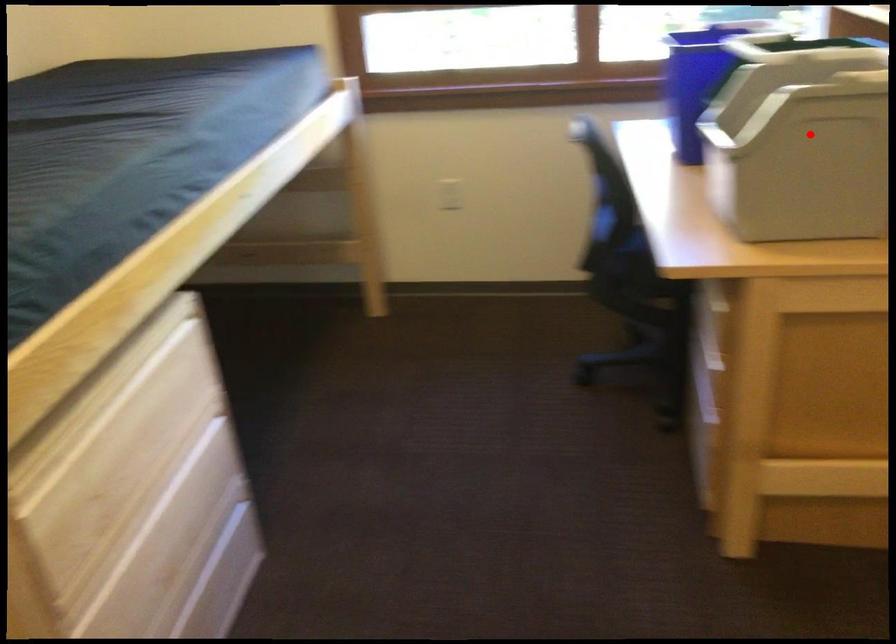
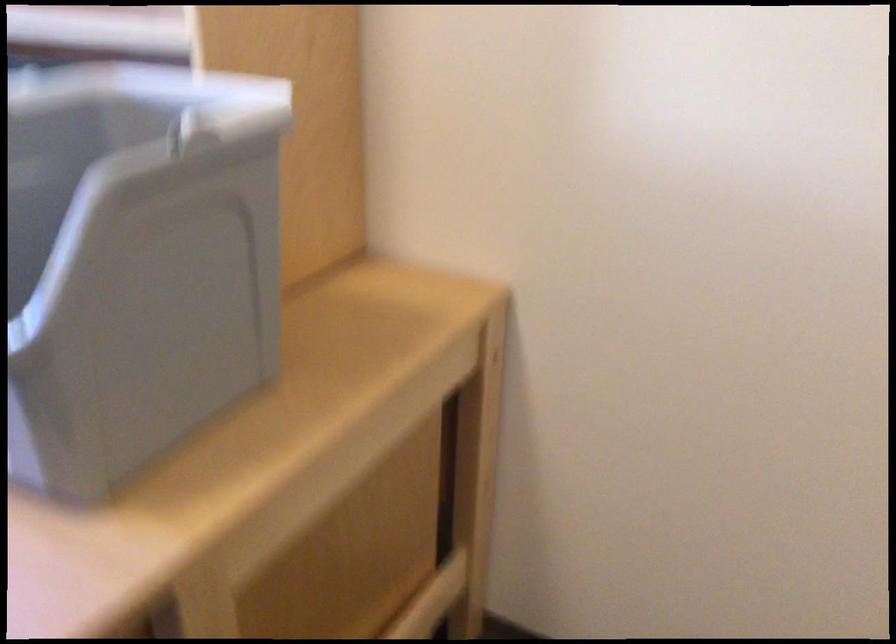
Question: I am providing you with two images of the same scene from different viewpoints. A red point is shown in image1. For the corresponding object point in image2, is it positioned nearer or farther from the camera?

Choices:
 (A) Nearer
 (B) Farther

Answer: (A)